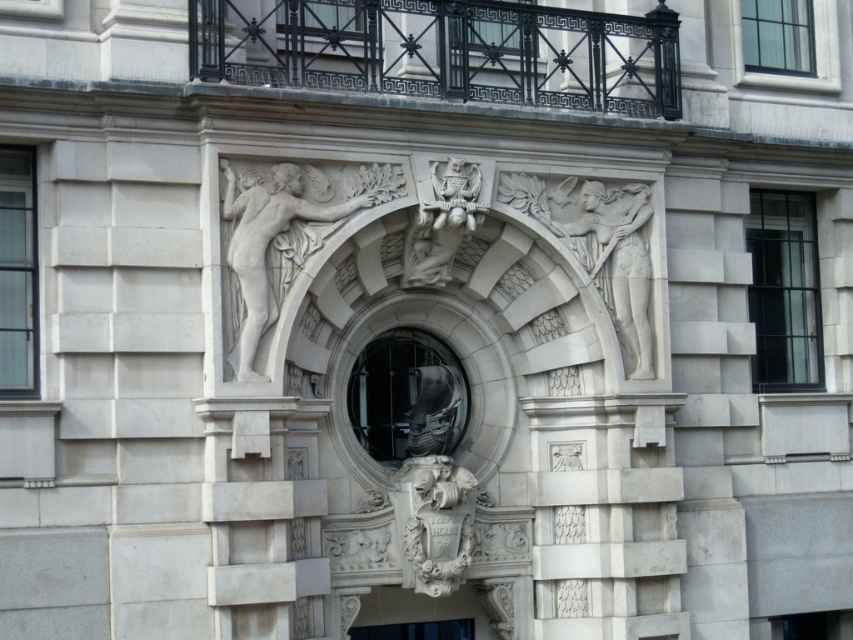
Which is below, white stone coat of arms at center or white stone eagle at center?

white stone coat of arms at center is lower down.

Can you confirm if white stone coat of arms at center is smaller than white stone eagle at center?

Yes, white stone coat of arms at center is smaller than white stone eagle at center.

Image resolution: width=853 pixels, height=640 pixels. What do you see at coordinates (434, 522) in the screenshot?
I see `white stone coat of arms at center` at bounding box center [434, 522].

At what (x,y) coordinates should I click in order to perform the action: click on white stone coat of arms at center. Please return your answer as a coordinate pair (x, y). Image resolution: width=853 pixels, height=640 pixels. Looking at the image, I should click on (434, 522).

Can you confirm if white marble cherub at upper left is taller than white stone statue at center?

Yes, white marble cherub at upper left is taller than white stone statue at center.

Who is more forward, (291, 268) or (349, 632)?

Answer: Point (291, 268)

This screenshot has width=853, height=640. In order to click on white marble cherub at upper left in this screenshot , I will do `click(273, 248)`.

Between white stone relief at upper right and white stone eagle at center, which one is positioned lower?

white stone relief at upper right is lower down.

Looking at this image, who is higher up, white stone relief at upper right or white stone eagle at center?

white stone eagle at center is higher up.

Is point (640, 371) more distant than point (438, 184)?

Yes, it is.

The height and width of the screenshot is (640, 853). I want to click on white stone relief at upper right, so (x=618, y=262).